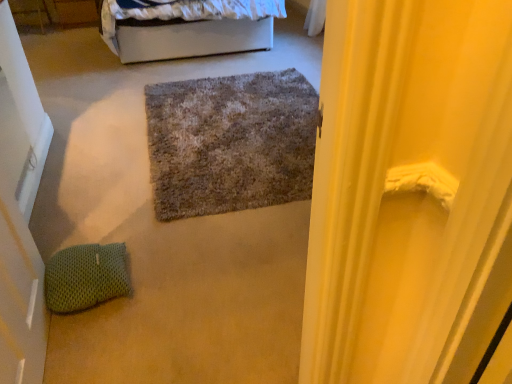
Describe the element at coordinates (230, 143) in the screenshot. I see `textured gray rug at center` at that location.

In order to face white fabric bed at upper center, should I rotate leftwards or rightwards?

Turn left approximately 10.044 degrees to face it.

What do you see at coordinates (86, 277) in the screenshot? The height and width of the screenshot is (384, 512). I see `green knitted pillow at lower left` at bounding box center [86, 277].

The image size is (512, 384). Describe the element at coordinates (20, 215) in the screenshot. I see `white matte door at left` at that location.

Locate an element on the screen. white matte door at left is located at coordinates (20, 215).

Measure the distance between wooden drawer at upper left and camera.

A distance of 4.76 meters exists between wooden drawer at upper left and camera.

Locate an element on the screen. textured gray rug at center is located at coordinates (230, 143).

Is textured gray rug at center positioned with its back to green knitted pillow at lower left?

No, textured gray rug at center's orientation is not away from green knitted pillow at lower left.

From a real-world perspective, which object stands above the other?

From a 3D spatial view, green knitted pillow at lower left is above.

Is textured gray rug at center positioned behind green knitted pillow at lower left?

Yes, the depth of textured gray rug at center is greater than that of green knitted pillow at lower left.

In the scene shown: Between textured gray rug at center and green knitted pillow at lower left, which one appears on the right side from the viewer's perspective?

Positioned to the right is textured gray rug at center.

Between green knitted pillow at lower left and wooden drawer at upper left, which one has more height?

With more height is wooden drawer at upper left.

From the image's perspective, is green knitted pillow at lower left on wooden drawer at upper left?

Actually, green knitted pillow at lower left appears below wooden drawer at upper left in the image.

Find the location of a particular element. The height and width of the screenshot is (384, 512). drawer above the green knitted pillow at lower left (from the image's perspective) is located at coordinates (76, 12).

Based on the photo, is white matte door at left looking in the opposite direction of green knitted pillow at lower left?

No.

Can you tell me how much white matte door at left and green knitted pillow at lower left differ in facing direction?

The angle between the facing direction of white matte door at left and the facing direction of green knitted pillow at lower left is 4.54 degrees.

Which is in front, point (52, 131) or point (93, 271)?

Point (93, 271)

Where is `bed located on the left of white matte door at left`? bed located on the left of white matte door at left is located at coordinates (187, 28).

Is white matte door at left oriented away from white fabric bed at upper center?

No, white fabric bed at upper center is not at the back of white matte door at left.

Can you confirm if white matte door at left is thinner than white fabric bed at upper center?

Indeed, white matte door at left has a lesser width compared to white fabric bed at upper center.

Between green knitted pillow at lower left and white matte door at left, which one has more height?

white matte door at left is taller.

Does green knitted pillow at lower left come in front of white matte door at left?

No, green knitted pillow at lower left is further to the viewer.

Looking at their sizes, would you say green knitted pillow at lower left is wider or thinner than white matte door at left?

green knitted pillow at lower left is wider than white matte door at left.

Is green knitted pillow at lower left thinner than white fabric bed at upper center?

Indeed, green knitted pillow at lower left has a lesser width compared to white fabric bed at upper center.

Is green knitted pillow at lower left inside or outside of white fabric bed at upper center?

The correct answer is: outside.

From a real-world perspective, which object stands above the other?

From a 3D spatial view, white fabric bed at upper center is above.

Does point (69, 247) lie behind point (218, 13)?

No, (69, 247) is in front of (218, 13).

Which object is positioned more to the left, textured gray rug at center or wooden drawer at upper left?

wooden drawer at upper left is more to the left.

What's the angular difference between textured gray rug at center and wooden drawer at upper left's facing directions?

1.13 degrees.

In terms of size, does textured gray rug at center appear bigger or smaller than wooden drawer at upper left?

textured gray rug at center is bigger than wooden drawer at upper left.

Is textured gray rug at center inside the boundaries of wooden drawer at upper left, or outside?

textured gray rug at center is located beyond the bounds of wooden drawer at upper left.

I want to click on pillow in front of the textured gray rug at center, so click(x=86, y=277).

Locate an element on the screen. The width and height of the screenshot is (512, 384). drawer that is above the green knitted pillow at lower left (from the image's perspective) is located at coordinates (76, 12).

Which object lies nearer to the anchor point wooden drawer at upper left, white matte door at left or green knitted pillow at lower left?

white matte door at left is closer to wooden drawer at upper left.

When comparing their distances from white matte door at left, does white fabric bed at upper center or textured gray rug at center seem closer?

textured gray rug at center is positioned closer to the anchor white matte door at left.

Looking at this image, looking at the image, which one is located closer to white matte door at left, green knitted pillow at lower left or white fabric bed at upper center?

green knitted pillow at lower left lies closer to white matte door at left than the other object.

Which object lies nearer to the anchor point green knitted pillow at lower left, white fabric bed at upper center or textured gray rug at center?

Based on the image, textured gray rug at center appears to be nearer to green knitted pillow at lower left.

Considering their positions, is green knitted pillow at lower left positioned further to wooden drawer at upper left than white matte door at left?

green knitted pillow at lower left is positioned further to the anchor wooden drawer at upper left.

Looking at the image, which one is located closer to wooden drawer at upper left, white fabric bed at upper center or textured gray rug at center?

white fabric bed at upper center.

Which object lies nearer to the anchor point white matte door at left, textured gray rug at center or white fabric bed at upper center?

textured gray rug at center lies closer to white matte door at left than the other object.

Which object lies nearer to the anchor point white matte door at left, wooden drawer at upper left or textured gray rug at center?

textured gray rug at center lies closer to white matte door at left than the other object.

At what (x,y) coordinates should I click in order to perform the action: click on bed located between white matte door at left and wooden drawer at upper left in the depth direction. Please return your answer as a coordinate pair (x, y). This screenshot has height=384, width=512. Looking at the image, I should click on (187, 28).

This screenshot has width=512, height=384. I want to click on pillow located between white matte door at left and textured gray rug at center in the depth direction, so click(x=86, y=277).

Identify the location of bed between green knitted pillow at lower left and wooden drawer at upper left from front to back. Image resolution: width=512 pixels, height=384 pixels. (187, 28).

Identify the location of door between white fabric bed at upper center and green knitted pillow at lower left vertically. (20, 215).